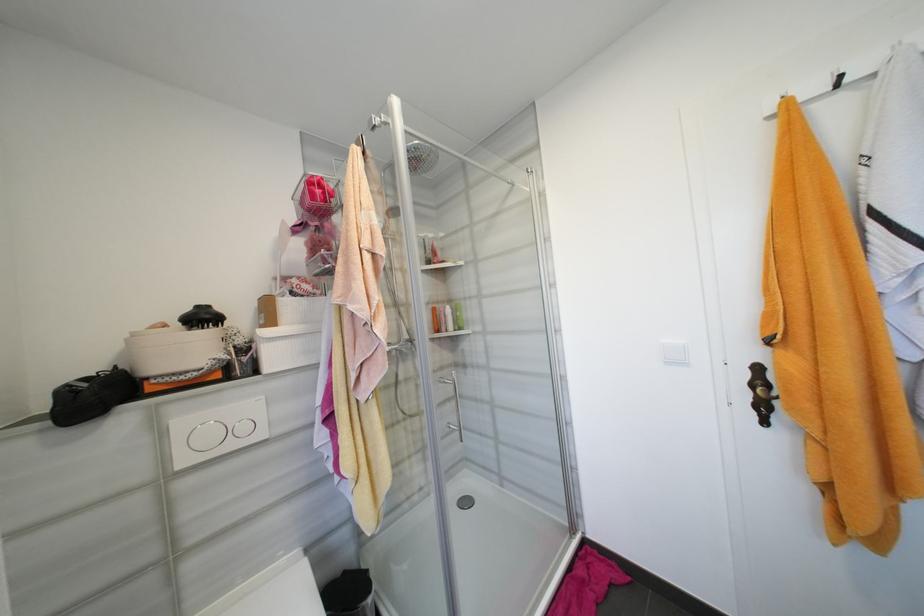
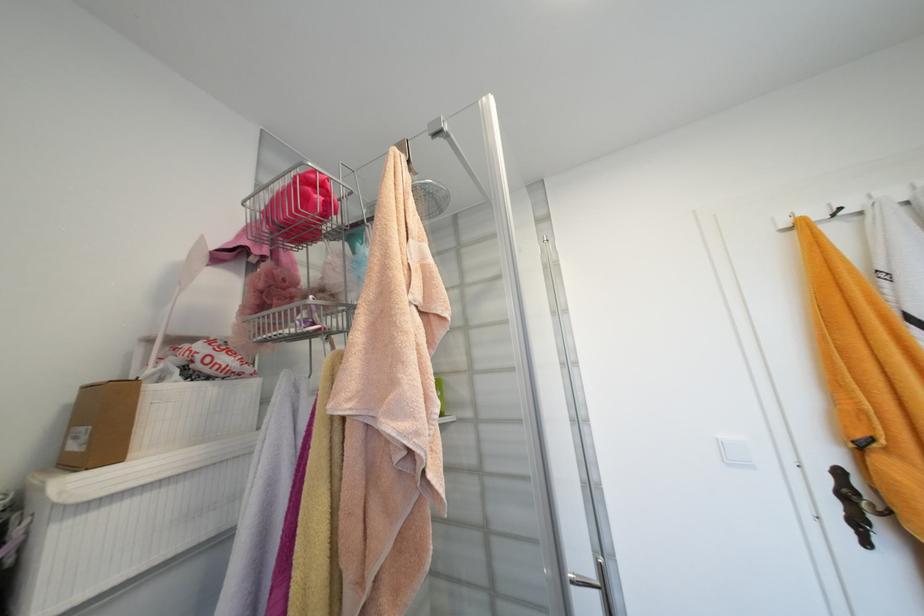
In the second image, find the point that corresponds to point (282, 280) in the first image.

(154, 342)